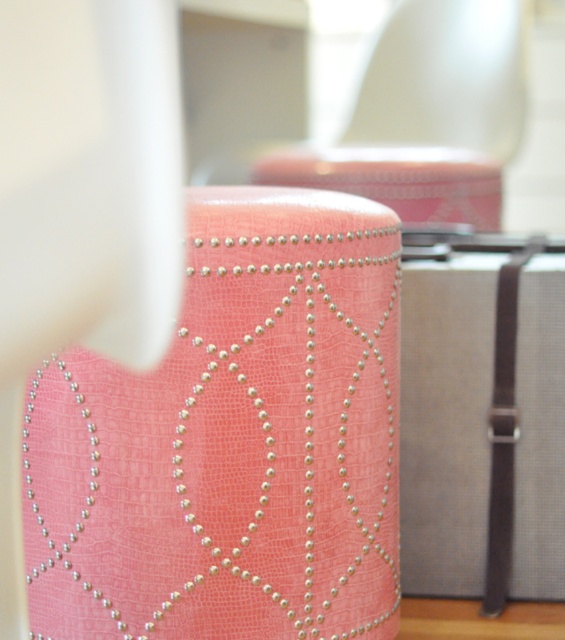
Question: Which object appears farthest from the camera in this image?

Choices:
 (A) gray fabric suitcase at center
 (B) pearltextured fabricstool at center

Answer: (A)

Question: Which point is closer to the camera?

Choices:
 (A) (515, 35)
 (B) (385, 600)

Answer: (B)

Question: Is pearltextured fabricstool at center thinner than gray fabric suitcase at center?

Choices:
 (A) yes
 (B) no

Answer: (B)

Question: Is the position of pearltextured fabricstool at center more distant than that of gray fabric suitcase at center?

Choices:
 (A) no
 (B) yes

Answer: (A)

Question: Which object is positioned farthest from the gray fabric suitcase at center?

Choices:
 (A) pink textured ottoman at upper center
 (B) pearltextured fabricstool at center

Answer: (A)

Question: Does pearltextured fabricstool at center lie behind pink textured ottoman at upper center?

Choices:
 (A) no
 (B) yes

Answer: (A)